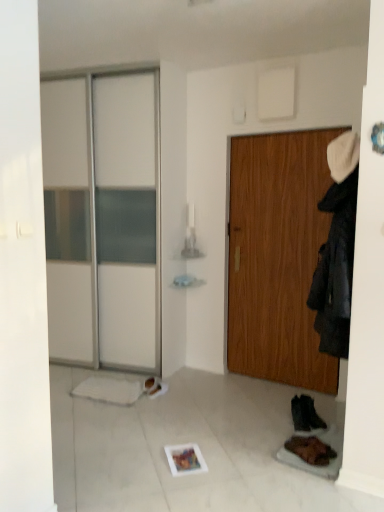
Where is `blank space to the left of black suede boot at lower right, positioned as the first footwear in back-to-front order`? blank space to the left of black suede boot at lower right, positioned as the first footwear in back-to-front order is located at coordinates (281, 420).